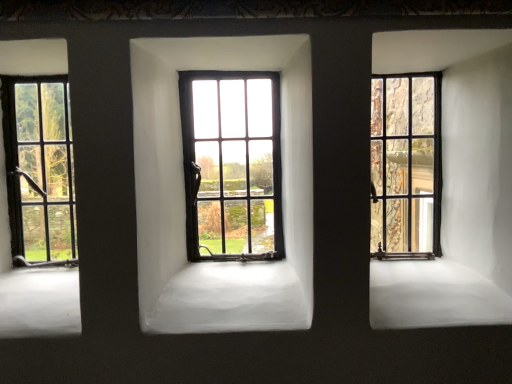
This screenshot has width=512, height=384. What do you see at coordinates (406, 165) in the screenshot? I see `matte black window at right, positioned as the 3th window in left-to-right order` at bounding box center [406, 165].

Measure the distance between point [234,145] and camera.

Point [234,145] is 1.33 meters away from camera.

This screenshot has height=384, width=512. Find the location of `matte black window at left, the third window viewed from the right`. matte black window at left, the third window viewed from the right is located at coordinates (39, 168).

Considering the points (276, 248) and (33, 143), which point is behind, point (276, 248) or point (33, 143)?

The point (276, 248) is farther from the camera.

From the image's perspective, which one is positioned lower, matte black window at center, which is the 2th window from left to right, or matte black window at left, the third window viewed from the right?

matte black window at left, the third window viewed from the right, is shown below in the image.

How different are the orientations of matte black window at center, arranged as the second window when viewed from the right, and matte black window at left, the third window viewed from the right, in degrees?

There is a 0.805-degree angle between the facing directions of matte black window at center, arranged as the second window when viewed from the right, and matte black window at left, the third window viewed from the right.

Could you tell me if matte black window at center, which is the 2th window from left to right, is facing matte black window at left, the 1th window in the left-to-right sequence?

No, matte black window at center, which is the 2th window from left to right, is not oriented towards matte black window at left, the 1th window in the left-to-right sequence.

Is matte black window at right, marked as the 1th window in a right-to-left arrangement, placed right next to matte black window at left, the 1th window in the left-to-right sequence?

There is a gap between matte black window at right, marked as the 1th window in a right-to-left arrangement, and matte black window at left, the 1th window in the left-to-right sequence.

Is matte black window at right, marked as the 1th window in a right-to-left arrangement, facing towards matte black window at left, the third window viewed from the right?

No.

Based on the photo, how many degrees apart are the facing directions of matte black window at right, positioned as the 3th window in left-to-right order, and matte black window at left, the 1th window in the left-to-right sequence?

The facing directions of matte black window at right, positioned as the 3th window in left-to-right order, and matte black window at left, the 1th window in the left-to-right sequence, are 0.00926 degrees apart.

There is a matte black window at left, the third window viewed from the right. Identify the location of the 1st window above it (from a real-world perspective). The image size is (512, 384). (406, 165).

Looking at this image, considering the relative positions of matte black window at center, which is the 2th window from left to right, and matte black window at right, marked as the 1th window in a right-to-left arrangement, in the image provided, is matte black window at center, which is the 2th window from left to right, to the right of matte black window at right, marked as the 1th window in a right-to-left arrangement, from the viewer's perspective?

No.

Does matte black window at center, arranged as the second window when viewed from the right, have a larger size compared to matte black window at right, positioned as the 3th window in left-to-right order?

Indeed, matte black window at center, arranged as the second window when viewed from the right, has a larger size compared to matte black window at right, positioned as the 3th window in left-to-right order.

Is matte black window at center, arranged as the second window when viewed from the right, situated inside matte black window at right, positioned as the 3th window in left-to-right order, or outside?

matte black window at center, arranged as the second window when viewed from the right, is outside matte black window at right, positioned as the 3th window in left-to-right order.

From a real-world perspective, is matte black window at right, positioned as the 3th window in left-to-right order, under matte black window at center, which is the 2th window from left to right?

Yes.

Between point (382, 231) and point (275, 224), which one is positioned behind?

The point (275, 224) is behind.

From the image's perspective, is matte black window at right, positioned as the 3th window in left-to-right order, under matte black window at center, arranged as the second window when viewed from the right?

No, from the image's perspective, matte black window at right, positioned as the 3th window in left-to-right order, is not beneath matte black window at center, arranged as the second window when viewed from the right.

Does matte black window at right, positioned as the 3th window in left-to-right order, lie in front of matte black window at center, which is the 2th window from left to right?

No, it is not.

Is matte black window at center, arranged as the second window when viewed from the right, inside matte black window at left, the 1th window in the left-to-right sequence?

That's incorrect, matte black window at center, arranged as the second window when viewed from the right, is not inside matte black window at left, the 1th window in the left-to-right sequence.

Is matte black window at left, the 1th window in the left-to-right sequence, placed right next to matte black window at center, arranged as the second window when viewed from the right?

They are not placed beside each other.

Does point (50, 98) come farther from viewer compared to point (247, 256)?

Yes, point (50, 98) is farther from viewer.

Considering their positions, is matte black window at left, the third window viewed from the right, located in front of or behind matte black window at right, marked as the 1th window in a right-to-left arrangement?

In the image, matte black window at left, the third window viewed from the right, appears in front of matte black window at right, marked as the 1th window in a right-to-left arrangement.

From the image's perspective, is matte black window at left, the third window viewed from the right, located beneath matte black window at right, positioned as the 3th window in left-to-right order?

Yes, from the image's perspective, matte black window at left, the third window viewed from the right, is beneath matte black window at right, positioned as the 3th window in left-to-right order.

Is point (26, 204) closer to viewer compared to point (398, 218)?

Yes.

Considering the sizes of objects matte black window at left, the 1th window in the left-to-right sequence, and matte black window at right, marked as the 1th window in a right-to-left arrangement, in the image provided, who is smaller, matte black window at left, the 1th window in the left-to-right sequence, or matte black window at right, marked as the 1th window in a right-to-left arrangement,?

Smaller between the two is matte black window at left, the 1th window in the left-to-right sequence.

Find the location of a particular element. the 2nd window directly beneath the matte black window at center, which is the 2th window from left to right (from a real-world perspective) is located at coordinates (39, 168).

The image size is (512, 384). I want to click on window that is the 2nd one when counting rightward from the matte black window at left, the 1th window in the left-to-right sequence, so click(406, 165).

Looking at the image, which one is located closer to matte black window at center, which is the 2th window from left to right, matte black window at left, the third window viewed from the right, or matte black window at right, positioned as the 3th window in left-to-right order?

Based on the image, matte black window at right, positioned as the 3th window in left-to-right order, appears to be nearer to matte black window at center, which is the 2th window from left to right.

When comparing their distances from matte black window at left, the 1th window in the left-to-right sequence, does matte black window at right, positioned as the 3th window in left-to-right order, or matte black window at center, which is the 2th window from left to right, seem further?

Based on the image, matte black window at right, positioned as the 3th window in left-to-right order, appears to be further to matte black window at left, the 1th window in the left-to-right sequence.

Based on their spatial positions, is matte black window at center, arranged as the second window when viewed from the right, or matte black window at right, positioned as the 3th window in left-to-right order, further from matte black window at left, the 1th window in the left-to-right sequence?

The object further to matte black window at left, the 1th window in the left-to-right sequence, is matte black window at right, positioned as the 3th window in left-to-right order.

Consider the image. Which object lies further to the anchor point matte black window at right, positioned as the 3th window in left-to-right order, matte black window at left, the third window viewed from the right, or matte black window at center, arranged as the second window when viewed from the right?

matte black window at left, the third window viewed from the right, is further to matte black window at right, positioned as the 3th window in left-to-right order.

Estimate the real-world distances between objects in this image. Which object is further from matte black window at center, which is the 2th window from left to right, matte black window at right, positioned as the 3th window in left-to-right order, or matte black window at left, the 1th window in the left-to-right sequence?

Based on the image, matte black window at left, the 1th window in the left-to-right sequence, appears to be further to matte black window at center, which is the 2th window from left to right.

Considering their positions, is matte black window at center, which is the 2th window from left to right, positioned closer to matte black window at right, marked as the 1th window in a right-to-left arrangement, than matte black window at left, the 1th window in the left-to-right sequence?

Among the two, matte black window at center, which is the 2th window from left to right, is located nearer to matte black window at right, marked as the 1th window in a right-to-left arrangement.

Locate an element on the screen. Image resolution: width=512 pixels, height=384 pixels. window between matte black window at left, the 1th window in the left-to-right sequence, and matte black window at right, marked as the 1th window in a right-to-left arrangement, in the horizontal direction is located at coordinates (232, 165).